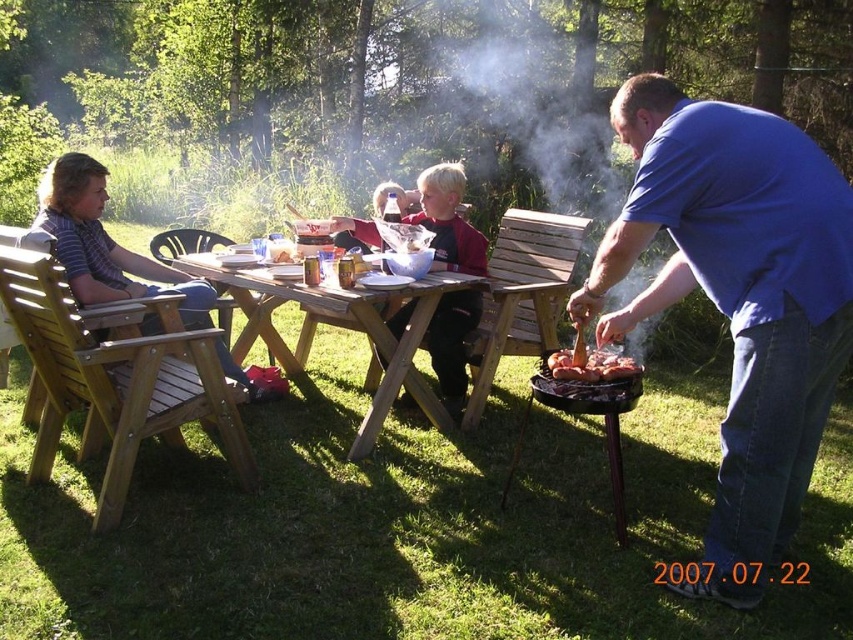
Can you confirm if blue cotton shirt at right is positioned to the left of dark blue shirt at center?

No, blue cotton shirt at right is not to the left of dark blue shirt at center.

Locate an element on the screen. blue cotton shirt at right is located at coordinates (738, 300).

Between blue cotton shirt at right and wooden picnic table at center, which one has more height?

With more height is blue cotton shirt at right.

What are the coordinates of `blue cotton shirt at right` in the screenshot? It's located at (738, 300).

Which is more to the left, blue cotton shirt at right or grilled meat at right?

Positioned to the left is grilled meat at right.

Does blue cotton shirt at right appear on the right side of grilled meat at right?

Correct, you'll find blue cotton shirt at right to the right of grilled meat at right.

Who is more distant from viewer, (x=621, y=308) or (x=625, y=365)?

The point (x=621, y=308) is more distant.

Locate an element on the screen. blue cotton shirt at right is located at coordinates (738, 300).